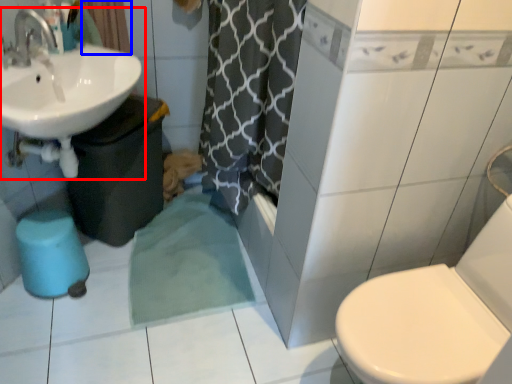
Question: Which object is closer to the camera taking this photo, sink (highlighted by a red box) or curtain (highlighted by a blue box)?

Choices:
 (A) sink
 (B) curtain

Answer: (A)